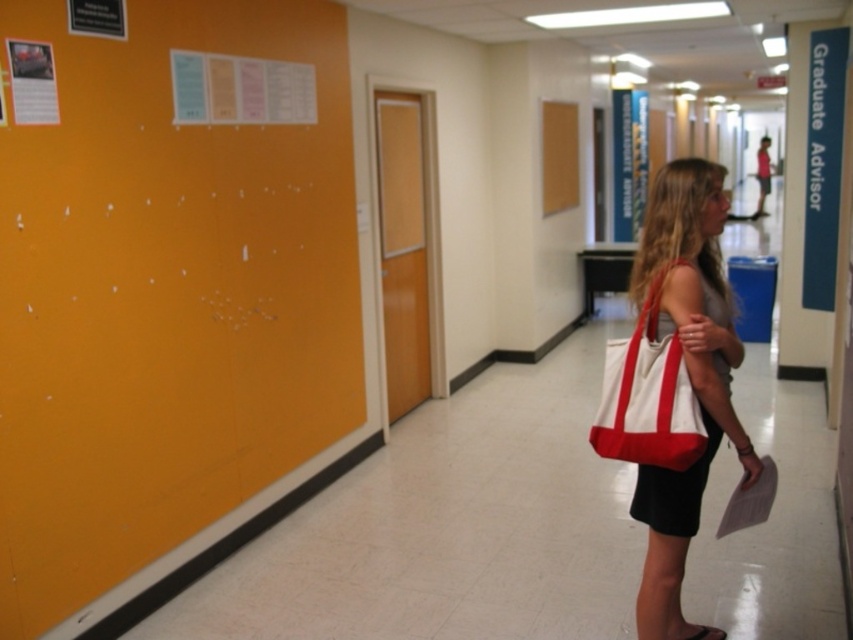
Does white canvas tote at right appear over black leather sandal at lower right?

Correct, white canvas tote at right is located above black leather sandal at lower right.

Which is more to the left, white canvas tote at right or black leather sandal at lower right?

Positioned to the left is white canvas tote at right.

Between point (653, 289) and point (711, 637), which one is positioned in front?

Point (653, 289)

This screenshot has width=853, height=640. I want to click on white canvas tote at right, so click(648, 396).

Does white canvas tote bag at center-right have a greater height compared to white canvas tote at right?

Correct, white canvas tote bag at center-right is much taller as white canvas tote at right.

Can you confirm if white canvas tote bag at center-right is thinner than white canvas tote at right?

No, white canvas tote bag at center-right is not thinner than white canvas tote at right.

Is point (639, 508) behind point (651, 355)?

Yes, it is behind point (651, 355).

The height and width of the screenshot is (640, 853). I want to click on white canvas tote bag at center-right, so click(x=686, y=369).

Based on the photo, does white canvas tote bag at center-right have a lesser height compared to black leather sandal at lower right?

No.

Between point (648, 492) and point (677, 632), which one is positioned behind?

Positioned behind is point (677, 632).

Is point (691, 182) positioned in front of point (717, 636)?

Yes, point (691, 182) is closer to viewer.

Find the location of `white canvas tote bag at center-right`. white canvas tote bag at center-right is located at coordinates (686, 369).